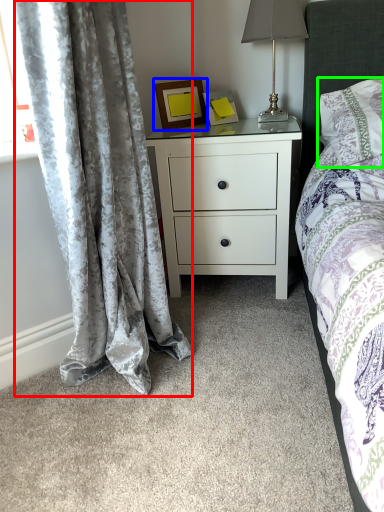
Question: Which is farther away from curtain (highlighted by a red box)? picture frame (highlighted by a blue box) or pillow (highlighted by a green box)?

Choices:
 (A) picture frame
 (B) pillow

Answer: (B)